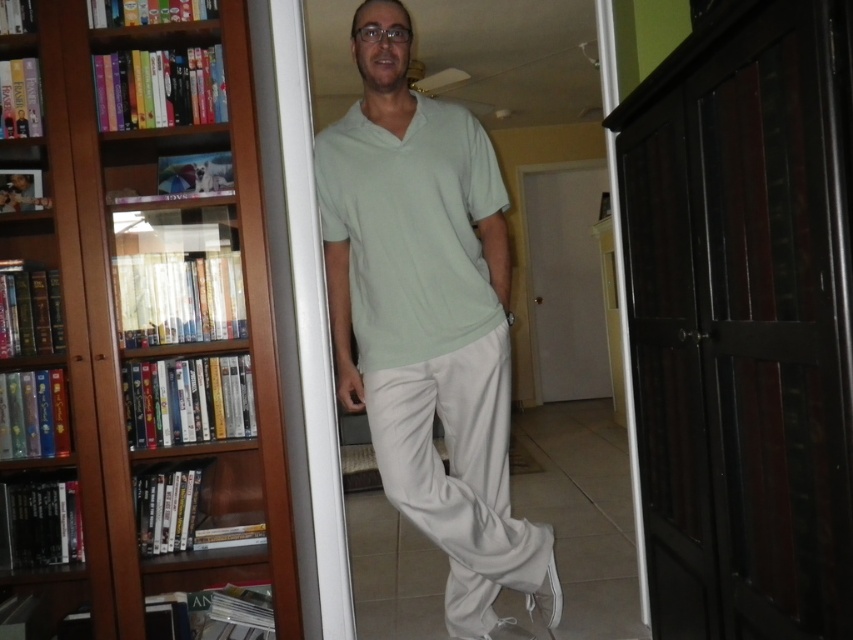
You are trying to decide which light green shirt to wear for an event. Both the light green fabric shirt at center and the light green cotton shirt at center are options. Which one is longer in length?

The light green fabric shirt at center is taller than the light green cotton shirt at center, so the light green fabric shirt at center is longer in length.